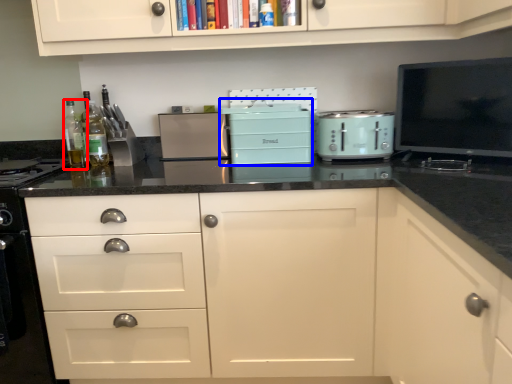
Question: Which object is further to the camera taking this photo, bottle (highlighted by a red box) or appliance (highlighted by a blue box)?

Choices:
 (A) bottle
 (B) appliance

Answer: (A)